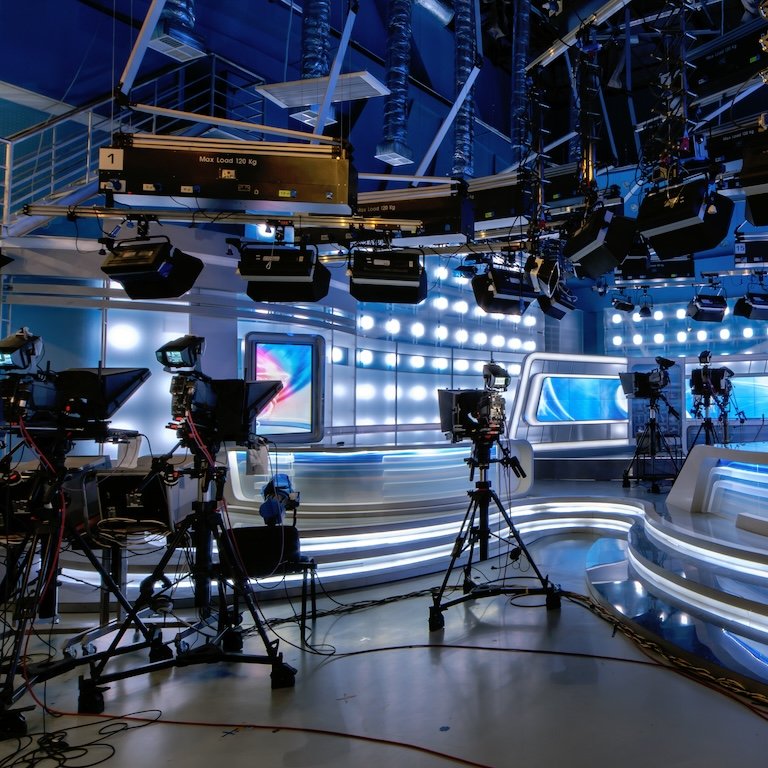
Find the location of a particular element. cables is located at coordinates (189, 722), (104, 737), (348, 607), (351, 650), (508, 558), (667, 454), (717, 428), (752, 425), (41, 591), (48, 550).